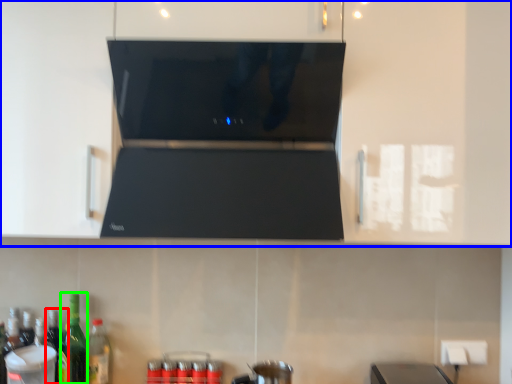
Question: Which object is positioned closest to bottle (highlighted by a red box)? Select from cabinetry (highlighted by a blue box) and bottle (highlighted by a green box).

Choices:
 (A) cabinetry
 (B) bottle

Answer: (B)